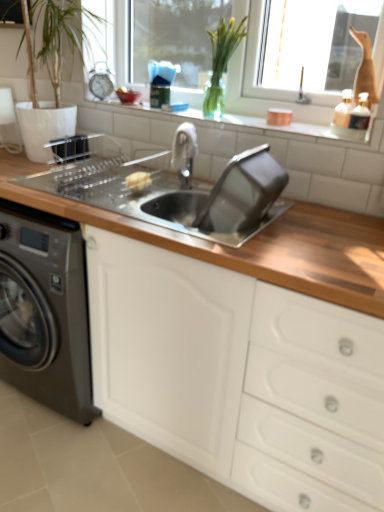
Question: Considering the relative sizes of wooden countertop at center and white plastic window frame at upper center in the image provided, is wooden countertop at center thinner than white plastic window frame at upper center?

Choices:
 (A) yes
 (B) no

Answer: (B)

Question: Considering the relative positions of wooden countertop at center and white plastic window frame at upper center in the image provided, is wooden countertop at center to the right of white plastic window frame at upper center from the viewer's perspective?

Choices:
 (A) no
 (B) yes

Answer: (A)

Question: From the image's perspective, is wooden countertop at center located beneath white plastic window frame at upper center?

Choices:
 (A) yes
 (B) no

Answer: (A)

Question: From a real-world perspective, is wooden countertop at center positioned over white plastic window frame at upper center based on gravity?

Choices:
 (A) no
 (B) yes

Answer: (A)

Question: Does wooden countertop at center have a greater height compared to white plastic window frame at upper center?

Choices:
 (A) no
 (B) yes

Answer: (B)

Question: Would you say polished chrome faucet at center is to the left or to the right of wooden countertop at center in the picture?

Choices:
 (A) right
 (B) left

Answer: (A)

Question: Looking at their shapes, would you say polished chrome faucet at center is wider or thinner than wooden countertop at center?

Choices:
 (A) wide
 (B) thin

Answer: (B)

Question: From the image's perspective, is polished chrome faucet at center positioned above or below wooden countertop at center?

Choices:
 (A) above
 (B) below

Answer: (A)

Question: Is polished chrome faucet at center taller or shorter than wooden countertop at center?

Choices:
 (A) tall
 (B) short

Answer: (B)

Question: Is wooden countertop at center wider or thinner than white plastic window frame at upper center?

Choices:
 (A) wide
 (B) thin

Answer: (A)

Question: Is point (119, 323) positioned closer to the camera than point (296, 114)?

Choices:
 (A) closer
 (B) farther

Answer: (A)

Question: Based on their sizes in the image, would you say wooden countertop at center is bigger or smaller than white plastic window frame at upper center?

Choices:
 (A) big
 (B) small

Answer: (A)

Question: Is wooden countertop at center to the left or to the right of white plastic window frame at upper center in the image?

Choices:
 (A) left
 (B) right

Answer: (A)

Question: From their relative heights in the image, would you say white glossy tile at upper center is taller or shorter than yellow sponge at sink?

Choices:
 (A) tall
 (B) short

Answer: (B)

Question: From the image's perspective, is white glossy tile at upper center positioned above or below yellow sponge at sink?

Choices:
 (A) above
 (B) below

Answer: (A)